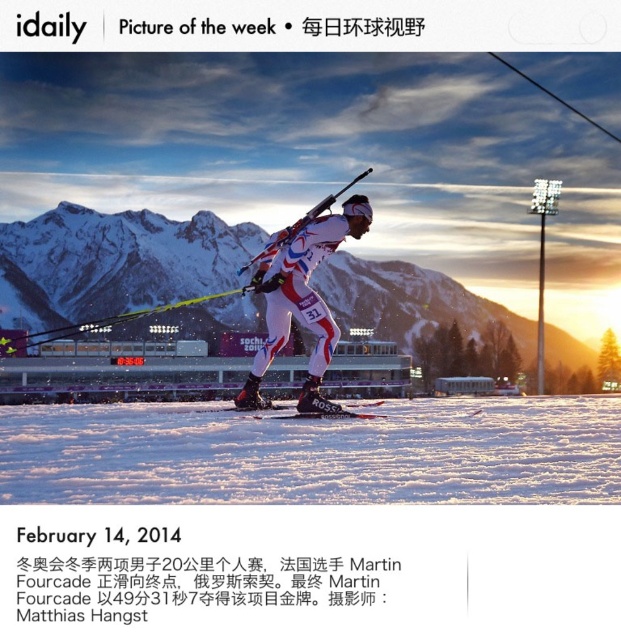
Question: Is white fluffy snow at lower center above white snow-covered mountain at center?

Choices:
 (A) no
 (B) yes

Answer: (A)

Question: Which object is closer to the camera taking this photo?

Choices:
 (A) white fluffy snow at lower center
 (B) white snow-covered mountain at center

Answer: (A)

Question: Which object appears closest to the camera in this image?

Choices:
 (A) white snow-covered mountain at center
 (B) white fluffy snow at lower center
 (C) white matte ski suit at center

Answer: (B)

Question: Which object appears farthest from the camera in this image?

Choices:
 (A) white snow-covered mountain at center
 (B) white fluffy snow at lower center
 (C) white matte ski suit at center

Answer: (A)

Question: Is white fluffy snow at lower center above white matte ski suit at center?

Choices:
 (A) no
 (B) yes

Answer: (A)

Question: Does white fluffy snow at lower center appear on the left side of white matte ski suit at center?

Choices:
 (A) yes
 (B) no

Answer: (B)